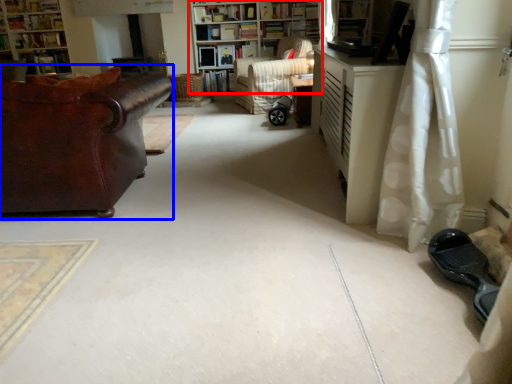
Question: Which object appears closest to the camera in this image, bookcase (highlighted by a red box) or studio couch (highlighted by a blue box)?

Choices:
 (A) bookcase
 (B) studio couch

Answer: (B)